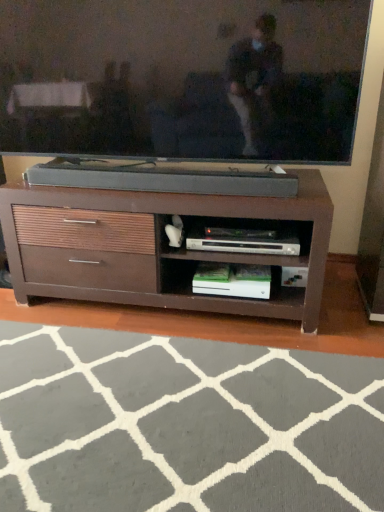
Question: Can you confirm if brown wood chest of drawers at center is thinner than gray soft rug at lower center?

Choices:
 (A) yes
 (B) no

Answer: (A)

Question: Would you say brown wood chest of drawers at center is a long distance from gray soft rug at lower center?

Choices:
 (A) no
 (B) yes

Answer: (A)

Question: Can you confirm if brown wood chest of drawers at center is smaller than gray soft rug at lower center?

Choices:
 (A) no
 (B) yes

Answer: (A)

Question: From a real-world perspective, is brown wood chest of drawers at center physically below gray soft rug at lower center?

Choices:
 (A) no
 (B) yes

Answer: (A)

Question: Is brown wood chest of drawers at center closer to the viewer compared to gray soft rug at lower center?

Choices:
 (A) yes
 (B) no

Answer: (B)

Question: Is brown wood chest of drawers at center not inside gray soft rug at lower center?

Choices:
 (A) no
 (B) yes

Answer: (B)

Question: Is matte black tv at upper center oriented away from gray soft rug at lower center?

Choices:
 (A) no
 (B) yes

Answer: (A)

Question: Could gray soft rug at lower center be considered to be inside matte black tv at upper center?

Choices:
 (A) no
 (B) yes

Answer: (A)

Question: Are matte black tv at upper center and gray soft rug at lower center beside each other?

Choices:
 (A) yes
 (B) no

Answer: (B)

Question: Is matte black tv at upper center smaller than gray soft rug at lower center?

Choices:
 (A) no
 (B) yes

Answer: (A)

Question: Considering the relative sizes of matte black tv at upper center and gray soft rug at lower center in the image provided, is matte black tv at upper center shorter than gray soft rug at lower center?

Choices:
 (A) no
 (B) yes

Answer: (A)

Question: Is matte black tv at upper center wider than gray soft rug at lower center?

Choices:
 (A) no
 (B) yes

Answer: (A)

Question: From the image's perspective, does matte black tv at upper center appear higher than brown wood chest of drawers at center?

Choices:
 (A) no
 (B) yes

Answer: (B)